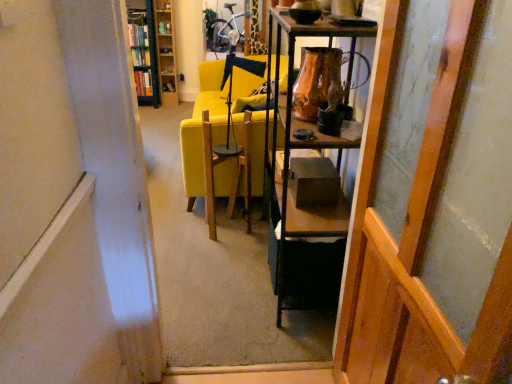
Identify the location of vacant space underneath wooden chair at center (from a real-world perspective). (232, 224).